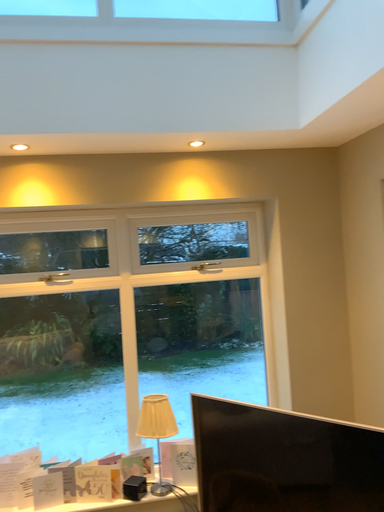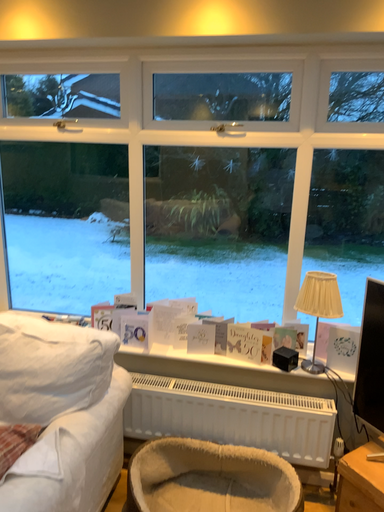
Question: How did the camera likely rotate when shooting the video?

Choices:
 (A) rotated downward
 (B) rotated upward

Answer: (A)